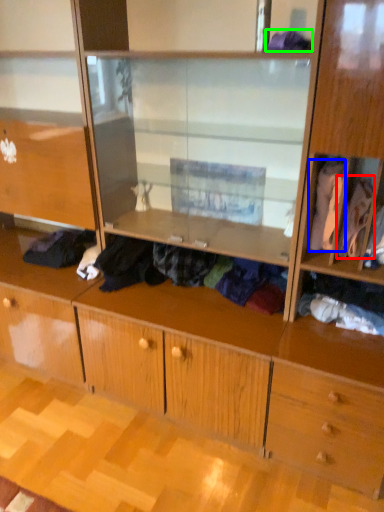
Question: Considering the real-world distances, which object is closest to clothing (highlighted by a red box)? clothing (highlighted by a blue box) or clothing (highlighted by a green box).

Choices:
 (A) clothing
 (B) clothing

Answer: (A)